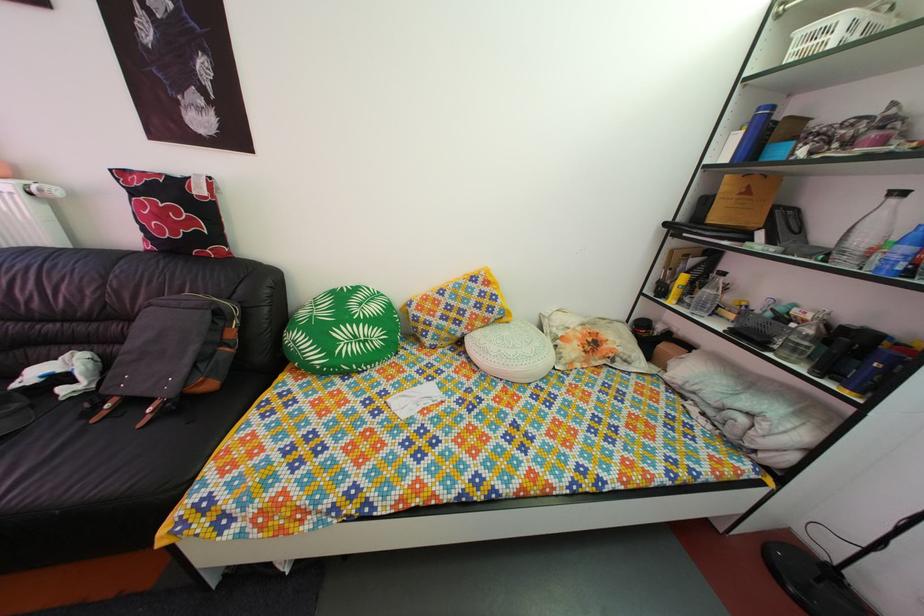
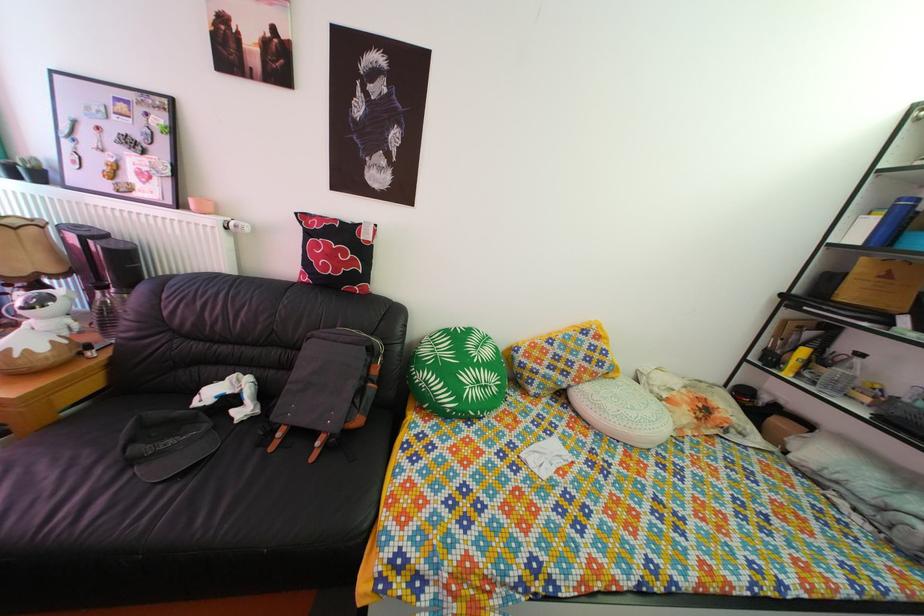
Find the pixel in the second image that matches point 103,428 in the first image.

(281, 456)